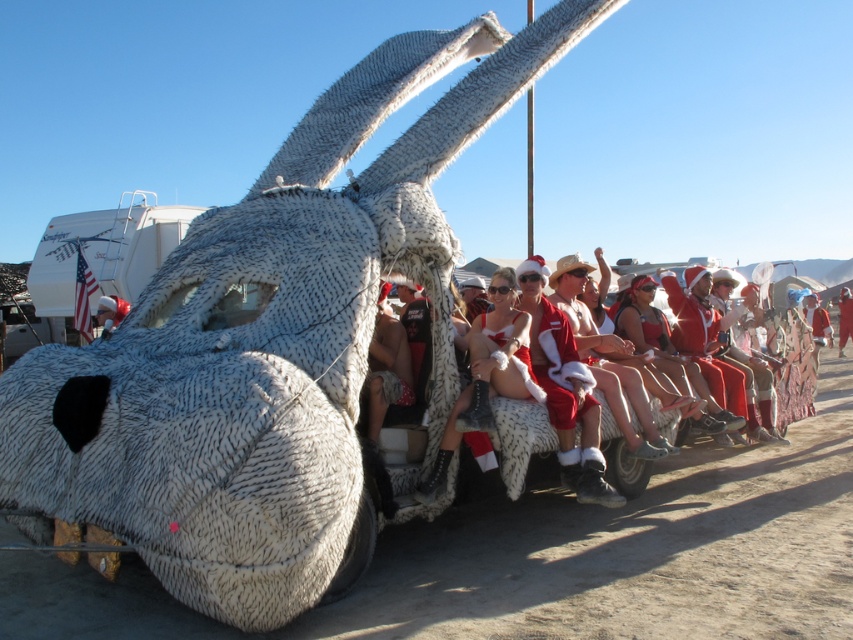
You are a photographer at the desert festival. You need to capture a closeup shot of the matte white helmet at center and the red santa suit at center. Which object will appear narrower in the photo?

The matte white helmet at center is thinner than the red santa suit at center, so it will appear narrower in the photo.

You are an event organizer at the desert festival and need to decide which item to place on the art car first. Since both the white fur coat at center and the matte white helmet at center are part of the decoration, which one requires more space due to its size?

The white fur coat at center requires more space because it is larger in size than the matte white helmet at center.

You are a photographer at the desert festival and want to capture a photo of the art car with both the white fur coat at center and matte white helmet at center in focus. Which object should you focus on first to ensure both are sharp in the photo?

The white fur coat at center is below matte white helmet at center. To ensure both are in focus, you should focus on the matte white helmet at center first since it is closer to the camera, and the white fur coat at center will naturally fall into focus as it is behind.